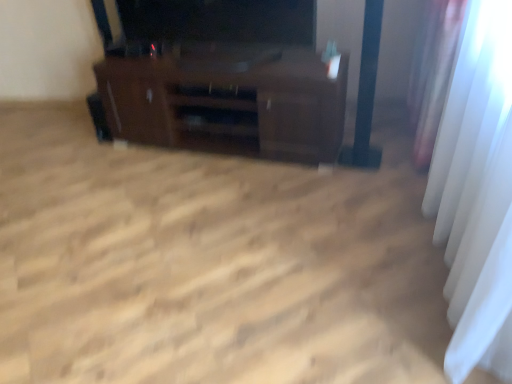
Find the location of `empty space that is in between dark brown wood tv stand at center and white sheer curtain at right`. empty space that is in between dark brown wood tv stand at center and white sheer curtain at right is located at coordinates (298, 220).